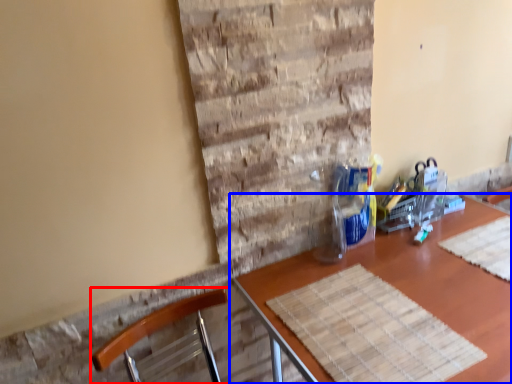
Question: Which object appears closest to the camera in this image, chair (highlighted by a red box) or table (highlighted by a blue box)?

Choices:
 (A) chair
 (B) table

Answer: (A)